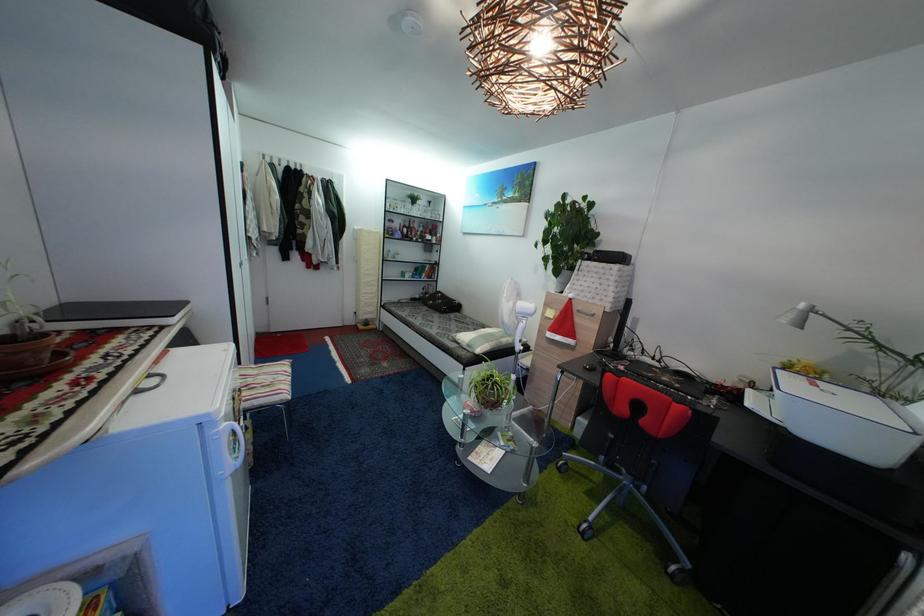
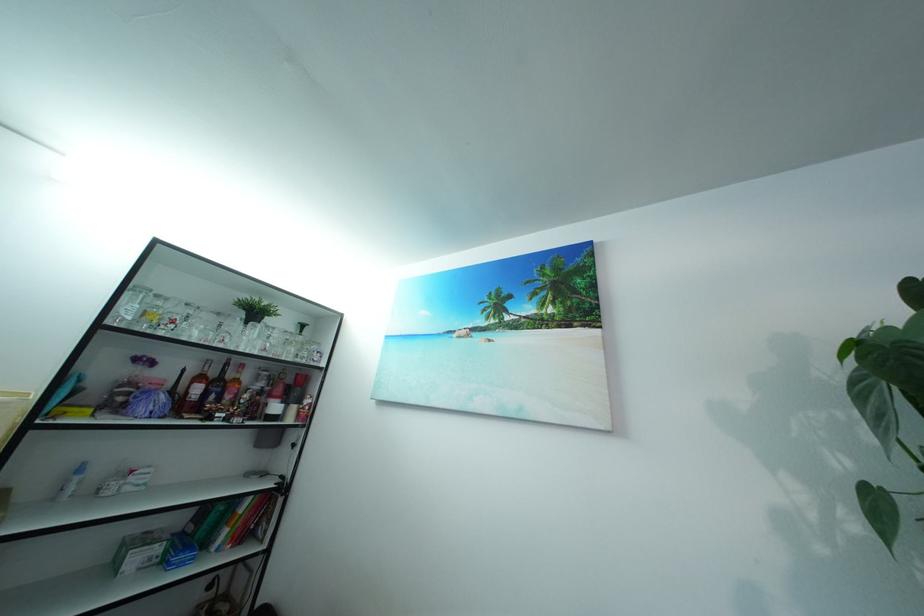
Where in the second image is the point corresponding to point 424,219 from the first image?

(257, 347)